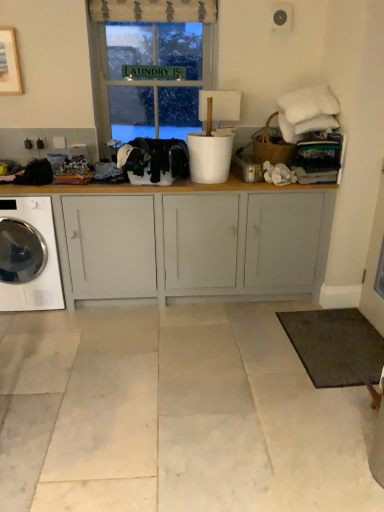
In order to face black fabric at center, the first clothing in the right-to-left sequence, should I rotate leftwards or rightwards?

Rotate your view left by about 5.467°.

Identify the location of black fabric at left, the 2th clothing from the right. (35, 174).

Identify the location of dark gray carpet at lower right. This screenshot has width=384, height=512. (335, 346).

In order to face dark gray carpet at lower right, should I rotate leftwards or rightwards?

Rotate right and turn 18.992 degrees.

The width and height of the screenshot is (384, 512). I want to click on white marble floor at center, so click(x=174, y=414).

This screenshot has height=512, width=384. Describe the element at coordinates (174, 414) in the screenshot. I see `white marble floor at center` at that location.

What are the coordinates of `green glass window at upper center` in the screenshot? It's located at (150, 65).

Is black fabric at left, arranged as the first clothing when viewed from the left, at the left side of white marble floor at center?

Yes, black fabric at left, arranged as the first clothing when viewed from the left, is to the left of white marble floor at center.

From a real-world perspective, who is located lower, black fabric at left, arranged as the first clothing when viewed from the left, or white marble floor at center?

white marble floor at center, from a real-world perspective.

Which of these two, black fabric at left, the 2th clothing from the right, or white marble floor at center, is thinner?

Thinner between the two is black fabric at left, the 2th clothing from the right.

Would you say black fabric at left, arranged as the first clothing when viewed from the left, is inside or outside white marble floor at center?

black fabric at left, arranged as the first clothing when viewed from the left, lies outside white marble floor at center.

Locate an element on the screen. This screenshot has width=384, height=512. mat below the white glossy washing machine at lower left (from a real-world perspective) is located at coordinates (335, 346).

Can dark gray carpet at lower right be found inside white glossy washing machine at lower left?

No, dark gray carpet at lower right is not a part of white glossy washing machine at lower left.

Considering the relative sizes of white glossy washing machine at lower left and dark gray carpet at lower right in the image provided, is white glossy washing machine at lower left smaller than dark gray carpet at lower right?

Actually, white glossy washing machine at lower left might be larger than dark gray carpet at lower right.

How distant is white glossy washing machine at lower left from dark gray carpet at lower right?

white glossy washing machine at lower left and dark gray carpet at lower right are 6.07 feet apart.

Is metallic silver canister at center to the left of green glass window at upper center from the viewer's perspective?

Incorrect, metallic silver canister at center is not on the left side of green glass window at upper center.

In the image, there is a green glass window at upper center. Find the location of `appliance below it (from the image's perspective)`. appliance below it (from the image's perspective) is located at coordinates (247, 168).

From a real-world perspective, is metallic silver canister at center physically located above or below green glass window at upper center?

Clearly, from a real-world perspective, metallic silver canister at center is below green glass window at upper center.

In the scene shown: Considering the relative positions of metallic silver canister at center and green glass window at upper center in the image provided, is metallic silver canister at center behind green glass window at upper center?

No, it is in front of green glass window at upper center.

Could dark gray carpet at lower right be considered to be inside metallic silver canister at center?

No.

From a real-world perspective, is metallic silver canister at center over dark gray carpet at lower right?

Indeed, from a real-world perspective, metallic silver canister at center stands above dark gray carpet at lower right.

Consider the image. How many degrees apart are the facing directions of metallic silver canister at center and dark gray carpet at lower right?

They differ by 88.5 degrees in their facing directions.

Which point is more forward, (x=242, y=162) or (x=370, y=374)?

The point (x=370, y=374) is closer.

How different are the orientations of dark gray carpet at lower right and green glass window at upper center in degrees?

There is a 88.2-degree angle between the facing directions of dark gray carpet at lower right and green glass window at upper center.

Is dark gray carpet at lower right shorter than green glass window at upper center?

Indeed, dark gray carpet at lower right has a lesser height compared to green glass window at upper center.

Measure the distance between dark gray carpet at lower right and green glass window at upper center.

dark gray carpet at lower right is 6.78 feet from green glass window at upper center.

From the image's perspective, relative to green glass window at upper center, is dark gray carpet at lower right above or below?

dark gray carpet at lower right is situated lower than green glass window at upper center in the image.

Considering the relative positions of white marble floor at center and green glass window at upper center in the image provided, is white marble floor at center to the left of green glass window at upper center from the viewer's perspective?

Incorrect, white marble floor at center is not on the left side of green glass window at upper center.

Is white marble floor at center oriented away from green glass window at upper center?

No, green glass window at upper center is not at the back of white marble floor at center.

Who is smaller, white marble floor at center or green glass window at upper center?

green glass window at upper center is smaller.

Does point (304, 312) appear closer or farther from the camera than point (181, 147)?

Clearly, point (304, 312) is more distant from the camera than point (181, 147).

Choose the correct answer: Is dark gray carpet at lower right inside black fabric at center, the second clothing from the left, or outside it?

dark gray carpet at lower right exists outside the volume of black fabric at center, the second clothing from the left.

Is dark gray carpet at lower right with black fabric at center, the second clothing from the left?

dark gray carpet at lower right and black fabric at center, the second clothing from the left, are clearly separated.

Consider the image. Based on their positions, is dark gray carpet at lower right located to the left or right of black fabric at center, the second clothing from the left?

dark gray carpet at lower right is to the right of black fabric at center, the second clothing from the left.

Where is `concrete below the black fabric at left, arranged as the first clothing when viewed from the left (from the image's perspective)`? concrete below the black fabric at left, arranged as the first clothing when viewed from the left (from the image's perspective) is located at coordinates (174, 414).

The image size is (384, 512). Identify the location of mat below the white glossy washing machine at lower left (from a real-world perspective). pos(335,346).

Estimate the real-world distances between objects in this image. Which object is closer to white glossy washing machine at lower left, matte gray cabinet at center or metallic silver canister at center?

Based on the image, matte gray cabinet at center appears to be nearer to white glossy washing machine at lower left.

Based on their spatial positions, is white marble floor at center or green glass window at upper center further from matte gray cabinet at center?

green glass window at upper center is further to matte gray cabinet at center.

Estimate the real-world distances between objects in this image. Which object is further from metallic silver canister at center, dark gray carpet at lower right or black fabric at left, the 2th clothing from the right?

black fabric at left, the 2th clothing from the right.

Which object lies further to the anchor point metallic silver canister at center, green glass window at upper center or black fabric at left, the 2th clothing from the right?

The object further to metallic silver canister at center is black fabric at left, the 2th clothing from the right.

Based on their spatial positions, is white marble floor at center or dark gray carpet at lower right further from matte gray cabinet at center?

white marble floor at center is positioned further to the anchor matte gray cabinet at center.

In the scene shown: When comparing their distances from matte gray cabinet at center, does dark gray carpet at lower right or black fabric at center, the first clothing in the right-to-left sequence, seem further?

dark gray carpet at lower right is positioned further to the anchor matte gray cabinet at center.

Considering their positions, is white marble floor at center positioned closer to green glass window at upper center than white glossy washing machine at lower left?

white glossy washing machine at lower left.

Which object lies further to the anchor point metallic silver canister at center, black fabric at left, arranged as the first clothing when viewed from the left, or green glass window at upper center?

Based on the image, black fabric at left, arranged as the first clothing when viewed from the left, appears to be further to metallic silver canister at center.

I want to click on appliance between black fabric at left, arranged as the first clothing when viewed from the left, and dark gray carpet at lower right, so click(247, 168).

Identify the location of cabinetry between white marble floor at center and black fabric at left, arranged as the first clothing when viewed from the left, from front to back. The width and height of the screenshot is (384, 512). (190, 239).

In order to click on window between white glossy washing machine at lower left and dark gray carpet at lower right from left to right in this screenshot , I will do `click(150, 65)`.

I want to click on cabinetry between green glass window at upper center and white glossy washing machine at lower left in the vertical direction, so click(x=190, y=239).